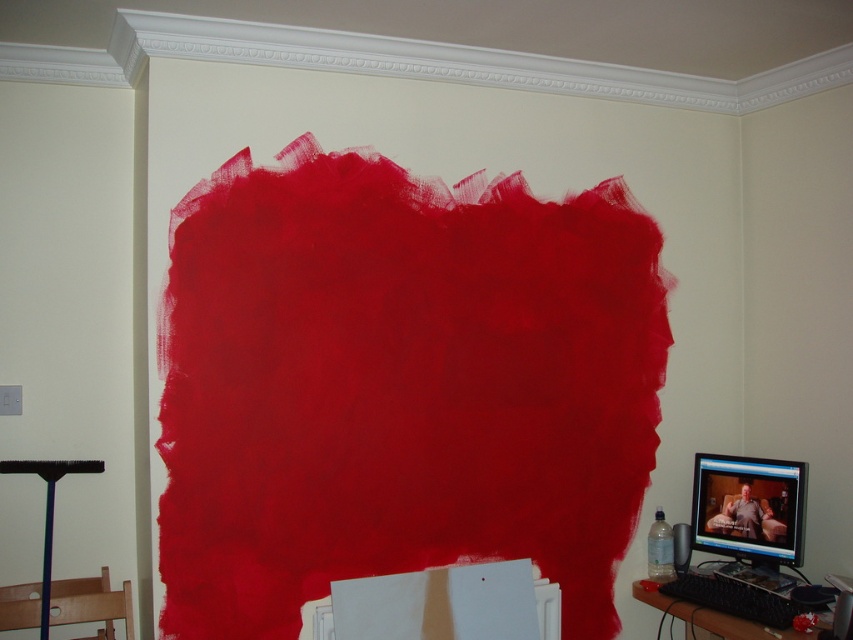
Does point (694, 602) come farther from viewer compared to point (48, 520)?

Yes, point (694, 602) is farther from viewer.

Which is more to the left, matte black keyboard at lower right or matte black brush at lower left?

From the viewer's perspective, matte black brush at lower left appears more on the left side.

Locate an element on the screen. matte black keyboard at lower right is located at coordinates (701, 616).

Between matte black monitor at lower right and matte black keyboard at lower right, which one is positioned lower?

matte black keyboard at lower right

Which is more to the right, matte black monitor at lower right or matte black keyboard at lower right?

Positioned to the right is matte black monitor at lower right.

Find the location of a particular element. matte black monitor at lower right is located at coordinates (749, 508).

Does matte black monitor at lower right have a smaller size compared to matte black brush at lower left?

Yes, matte black monitor at lower right is smaller than matte black brush at lower left.

Is matte black monitor at lower right bigger than matte black brush at lower left?

Incorrect, matte black monitor at lower right is not larger than matte black brush at lower left.

The width and height of the screenshot is (853, 640). I want to click on matte black monitor at lower right, so click(749, 508).

This screenshot has width=853, height=640. Find the location of `matte black monitor at lower right`. matte black monitor at lower right is located at coordinates (749, 508).